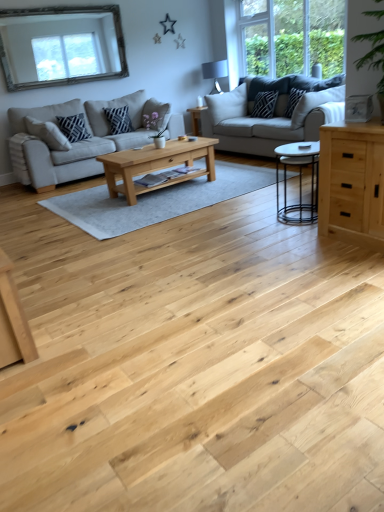
The image size is (384, 512). What are the coordinates of `vacant space in front of black metal coffee table at center, the 2th coffee table in the back-to-front sequence` in the screenshot? It's located at pos(292,237).